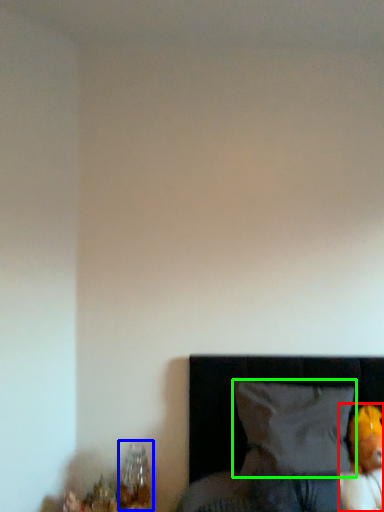
Question: Which object is positioned closest to toy (highlighted by a red box)? Select from table lamp (highlighted by a blue box) and pillow (highlighted by a green box).

Choices:
 (A) table lamp
 (B) pillow

Answer: (B)